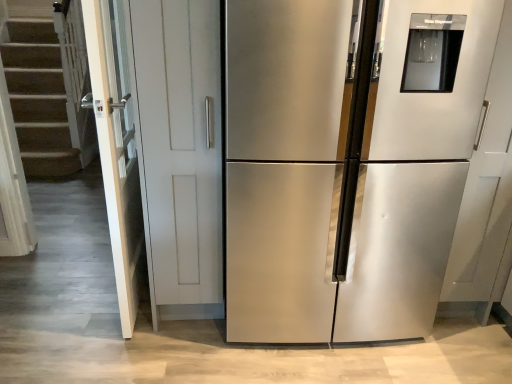
Question: In terms of height, does stainless steel refrigerator at center look taller or shorter compared to white glossy door at left?

Choices:
 (A) tall
 (B) short

Answer: (A)

Question: From a real-world perspective, is stainless steel refrigerator at center above or below white glossy door at left?

Choices:
 (A) above
 (B) below

Answer: (A)

Question: Considering the relative positions of stainless steel refrigerator at center and white glossy door at left in the image provided, is stainless steel refrigerator at center to the left or to the right of white glossy door at left?

Choices:
 (A) right
 (B) left

Answer: (A)

Question: In terms of width, does white glossy door at left look wider or thinner when compared to stainless steel refrigerator at center?

Choices:
 (A) thin
 (B) wide

Answer: (A)

Question: From a real-world perspective, is white glossy door at left positioned above or below stainless steel refrigerator at center?

Choices:
 (A) above
 (B) below

Answer: (B)

Question: From the image's perspective, relative to stainless steel refrigerator at center, is white glossy door at left above or below?

Choices:
 (A) below
 (B) above

Answer: (B)

Question: Considering the positions of white glossy door at left and stainless steel refrigerator at center in the image, is white glossy door at left taller or shorter than stainless steel refrigerator at center?

Choices:
 (A) short
 (B) tall

Answer: (A)